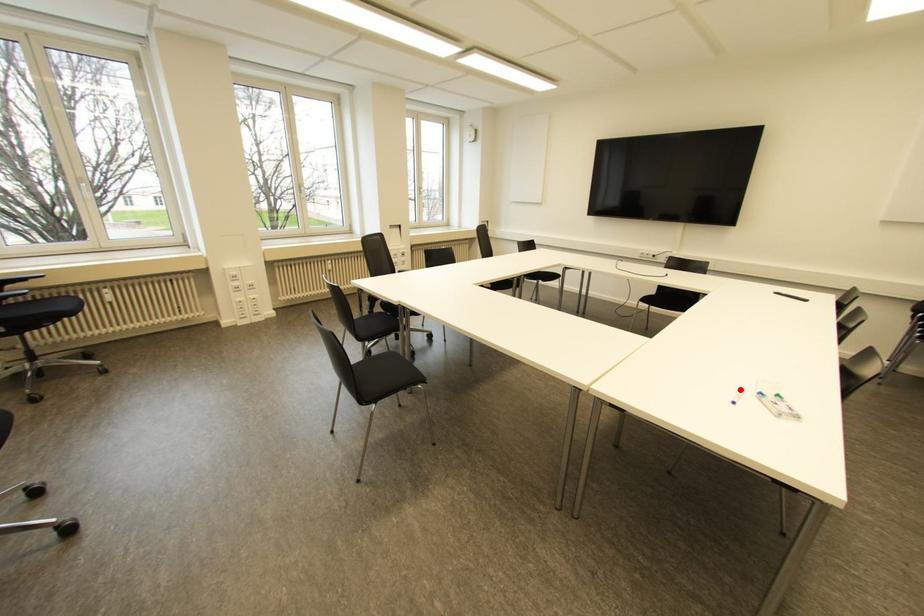
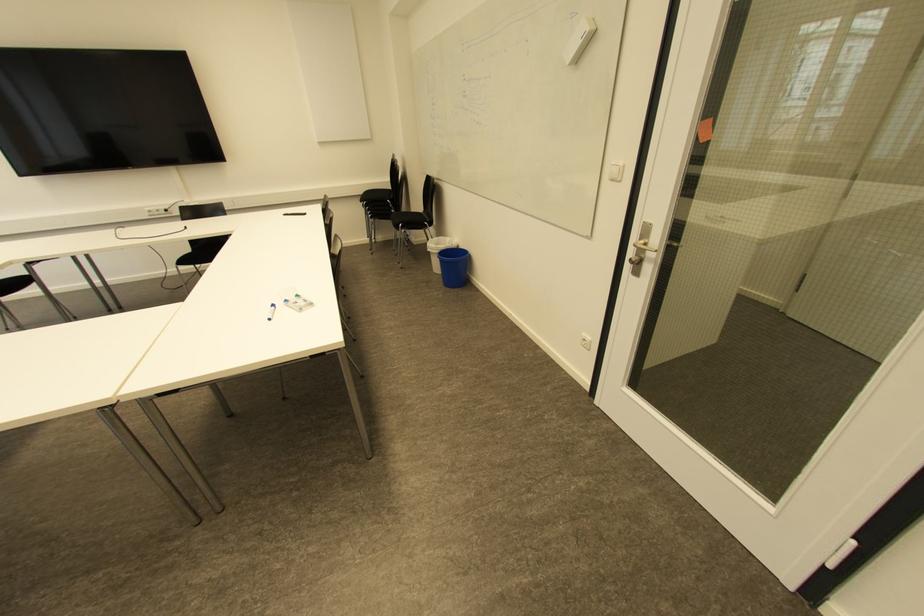
Question: A red point is marked in image1. In image2, is the corresponding 3D point closer to the camera or farther? Reply with the corresponding letter.

Choices:
 (A) The corresponding 3D point is closer.
 (B) The corresponding 3D point is farther.

Answer: (B)